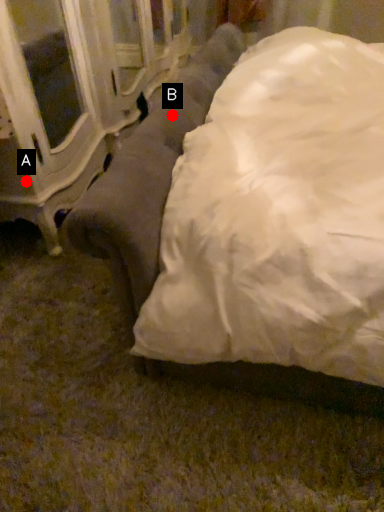
Question: Two points are circled on the image, labeled by A and B beside each circle. Among these points, which one is nearest to the camera?

Choices:
 (A) A is closer
 (B) B is closer

Answer: (B)